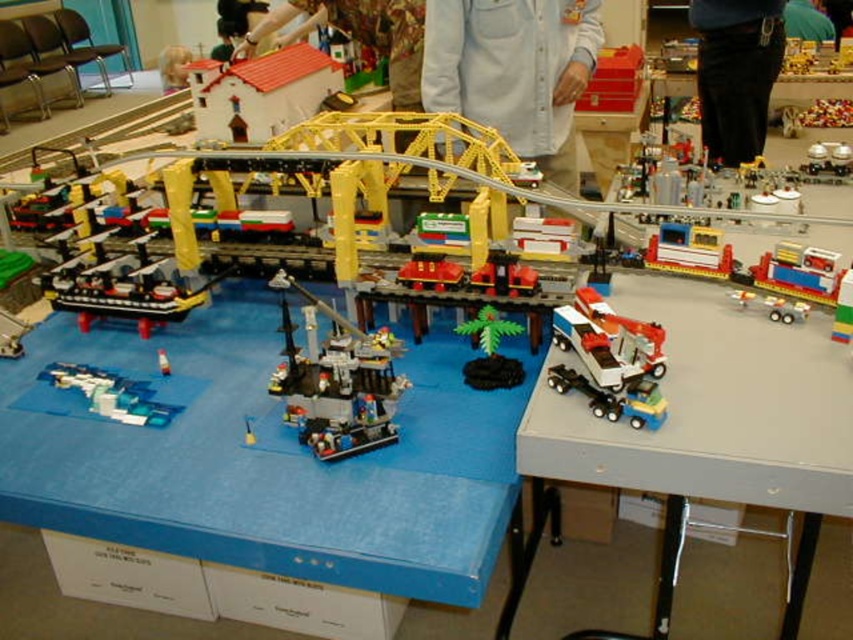
Between blue matte table at center and light blue fabric shirt at upper center, which one appears on the left side from the viewer's perspective?

Positioned to the left is blue matte table at center.

Consider the image. Does blue matte table at center have a lesser height compared to light blue fabric shirt at upper center?

Yes, blue matte table at center is shorter than light blue fabric shirt at upper center.

Which is in front, point (263, 536) or point (561, 81)?

Positioned in front is point (263, 536).

In order to click on blue matte table at center in this screenshot , I will do `click(270, 464)`.

Which is more to the right, light blue fabric shirt at upper center or yellow metallic bridge at upper center?

light blue fabric shirt at upper center

Which of these two, light blue fabric shirt at upper center or yellow metallic bridge at upper center, stands shorter?

light blue fabric shirt at upper center

Which is in front, point (556, 44) or point (73, 150)?

Point (556, 44) is more forward.

This screenshot has width=853, height=640. What are the coordinates of `light blue fabric shirt at upper center` in the screenshot? It's located at (514, 72).

Does point (302, 294) come closer to viewer compared to point (45, 365)?

Yes, point (302, 294) is in front of point (45, 365).

Who is more forward, (x=331, y=420) or (x=158, y=401)?

Positioned in front is point (x=331, y=420).

In order to click on black plastic ship at center in this screenshot , I will do `click(335, 380)`.